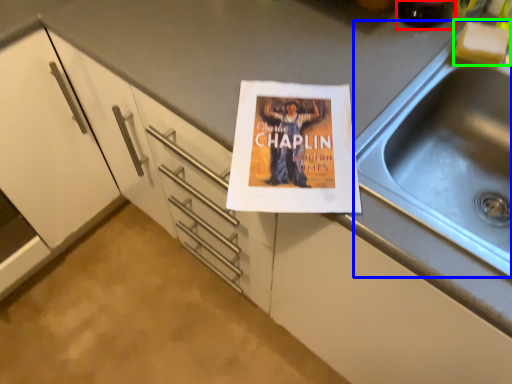
Question: Estimate the real-world distances between objects in this image. Which object is closer to beverage (highlighted by a red box), sink (highlighted by a blue box) or food (highlighted by a green box)?

Choices:
 (A) sink
 (B) food

Answer: (B)